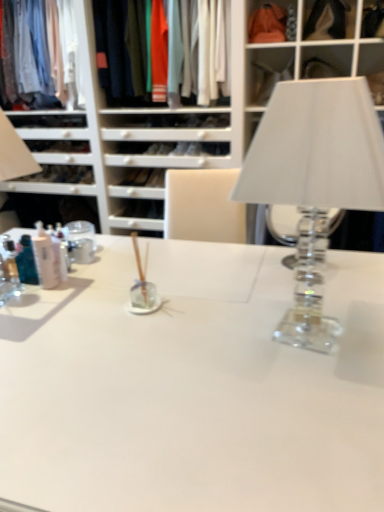
Question: Is matte orange fabric at upper center placed right next to clear glass table lamp at right?

Choices:
 (A) yes
 (B) no

Answer: (B)

Question: From a real-world perspective, is matte orange fabric at upper center physically below clear glass table lamp at right?

Choices:
 (A) yes
 (B) no

Answer: (B)

Question: Does matte orange fabric at upper center have a lesser width compared to clear glass table lamp at right?

Choices:
 (A) yes
 (B) no

Answer: (A)

Question: Is matte orange fabric at upper center further to the viewer compared to clear glass table lamp at right?

Choices:
 (A) no
 (B) yes

Answer: (B)

Question: Can you confirm if matte orange fabric at upper center is wider than clear glass table lamp at right?

Choices:
 (A) yes
 (B) no

Answer: (B)

Question: Is matte orange fabric at upper center facing towards clear glass table lamp at right?

Choices:
 (A) no
 (B) yes

Answer: (B)

Question: Is translucent plastic bottles at left aimed at clear glass table lamp at right?

Choices:
 (A) no
 (B) yes

Answer: (B)

Question: From the image's perspective, is translucent plastic bottles at left beneath clear glass table lamp at right?

Choices:
 (A) yes
 (B) no

Answer: (A)

Question: Does translucent plastic bottles at left have a lesser height compared to clear glass table lamp at right?

Choices:
 (A) no
 (B) yes

Answer: (B)

Question: Is translucent plastic bottles at left wider than clear glass table lamp at right?

Choices:
 (A) yes
 (B) no

Answer: (B)

Question: Is translucent plastic bottles at left at the left side of clear glass table lamp at right?

Choices:
 (A) yes
 (B) no

Answer: (A)

Question: Would you say translucent plastic bottles at left contains clear glass table lamp at right?

Choices:
 (A) no
 (B) yes

Answer: (A)

Question: Is translucent plastic bottles at left closer to camera compared to matte cotton shirts at upper center, the 1th clothing from the right?

Choices:
 (A) no
 (B) yes

Answer: (B)